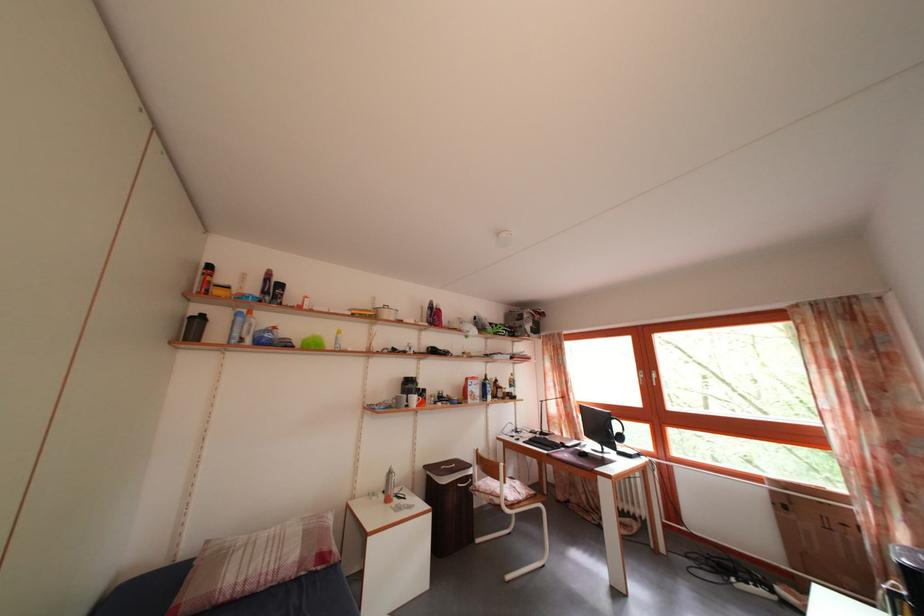
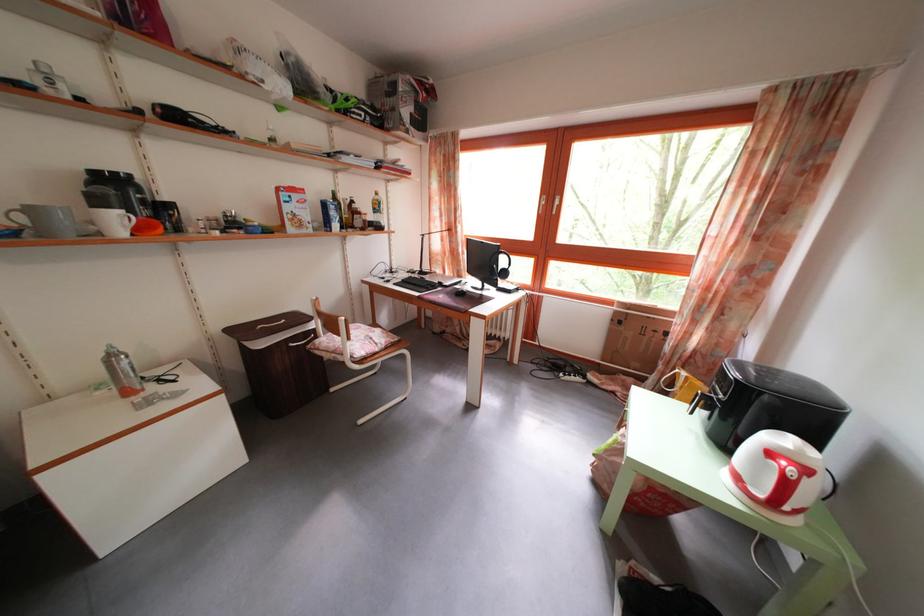
In the second image, find the point that corresponds to [397,480] in the first image.

(118, 363)